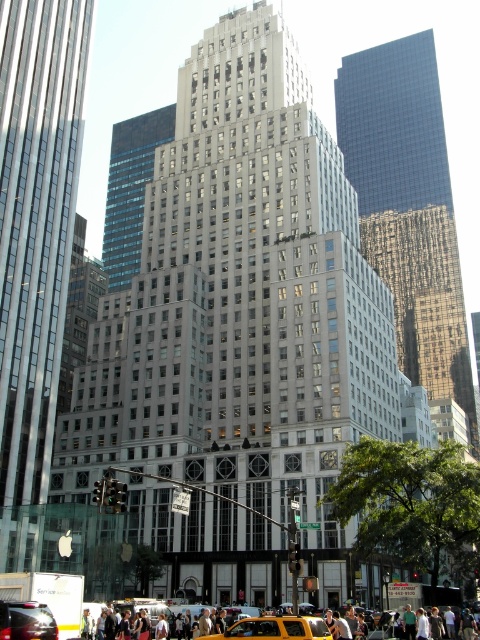
Consider the image. You are standing at point (x=274, y=628) in the city. What object is located at your current position?

The yellow matte taxi at center is located at point (x=274, y=628).

You are a pedestrian standing in front of the large classical building. You need to cross the street to reach the shiny black car at lower left. Which direction should you look first to avoid the yellow matte taxi at center?

You should look to the left first because the yellow matte taxi at center is to the right of the shiny black car at lower left, meaning it is positioned between you and the shiny black car at lower left. By checking left first, you can ensure you avoid the taxi before proceeding towards the car.